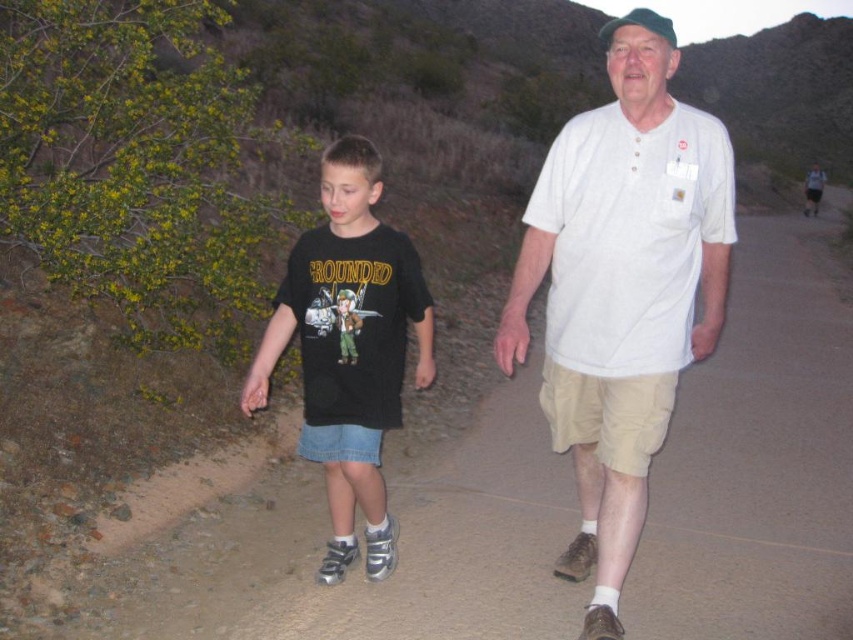
Question: Is white cotton shirt at center thinner than black cotton t-shirt at center?

Choices:
 (A) no
 (B) yes

Answer: (A)

Question: Which point is farther to the camera?

Choices:
 (A) (370, 358)
 (B) (576, 406)

Answer: (A)

Question: Is white cotton shirt at center bigger than black cotton t-shirt at center?

Choices:
 (A) yes
 (B) no

Answer: (A)

Question: Among these points, which one is farthest from the camera?

Choices:
 (A) (695, 326)
 (B) (376, 301)

Answer: (B)

Question: Which of the following is the farthest from the observer?

Choices:
 (A) (299, 252)
 (B) (665, 118)

Answer: (A)

Question: Does white cotton shirt at center have a lesser width compared to black cotton t-shirt at center?

Choices:
 (A) yes
 (B) no

Answer: (B)